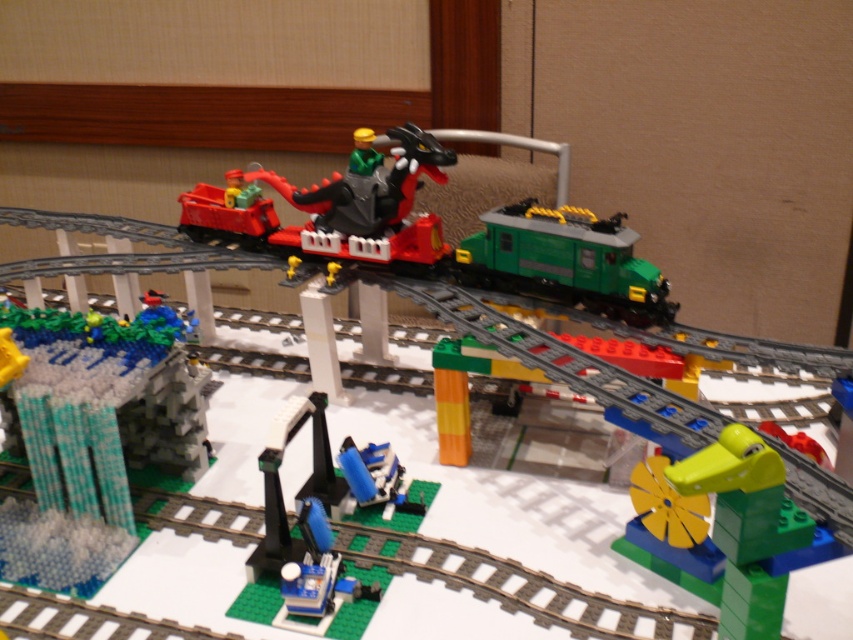
Is shiny green plastic crocodile at center above yellow matte figure at center?

Actually, shiny green plastic crocodile at center is below yellow matte figure at center.

Measure the distance between point (775,586) and camera.

A distance of 24.29 inches exists between point (775,586) and camera.

What do you see at coordinates (735, 532) in the screenshot? The image size is (853, 640). I see `shiny green plastic crocodile at center` at bounding box center [735, 532].

Find the location of `shiny green plastic crocodile at center`. shiny green plastic crocodile at center is located at coordinates (735, 532).

Does translucent blue water at lower left have a lesser width compared to shiny green plastic crocodile at center?

Incorrect, translucent blue water at lower left's width is not less than shiny green plastic crocodile at center's.

Is point (155, 413) farther from camera compared to point (712, 509)?

Yes, it is.

Where is `translucent blue water at lower left`? The height and width of the screenshot is (640, 853). translucent blue water at lower left is located at coordinates (94, 435).

Which of these two, translucent blue water at lower left or yellow matte figure at center, stands taller?

translucent blue water at lower left

This screenshot has width=853, height=640. Find the location of `translucent blue water at lower left`. translucent blue water at lower left is located at coordinates tap(94, 435).

Which is in front, point (54, 403) or point (289, 268)?

Positioned in front is point (54, 403).

Identify the location of translucent blue water at lower left. The height and width of the screenshot is (640, 853). (94, 435).